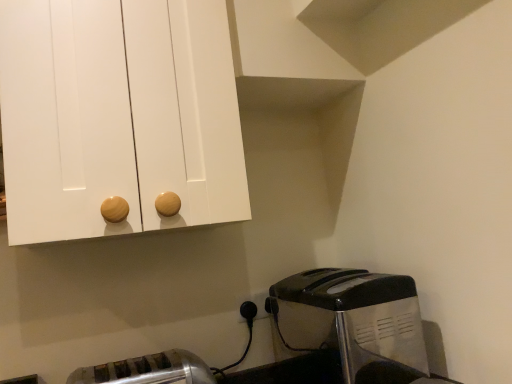
Identify the location of satin silver toaster at lower left, placed as the first toaster when sorted from left to right. (148, 370).

What do you see at coordinates (351, 322) in the screenshot? I see `metallic silver toaster at lower right, the first toaster in the right-to-left sequence` at bounding box center [351, 322].

This screenshot has width=512, height=384. Identify the location of satin silver toaster at lower left, which appears as the 2th toaster when viewed from the right. coord(148,370).

Does point (321, 269) lie behind point (255, 297)?

Yes, it is behind point (255, 297).

From the picture: Is metallic silver toaster at lower right, the first toaster in the right-to-left sequence, looking in the opposite direction of white plastic electric outlet at lower center?

No, metallic silver toaster at lower right, the first toaster in the right-to-left sequence,'s orientation is not away from white plastic electric outlet at lower center.

Can you confirm if metallic silver toaster at lower right, the first toaster in the right-to-left sequence, is positioned to the right of white plastic electric outlet at lower center?

Yes.

Is satin silver toaster at lower left, which appears as the 2th toaster when viewed from the right, surrounded by metallic silver toaster at lower right, the first toaster in the right-to-left sequence?

No, satin silver toaster at lower left, which appears as the 2th toaster when viewed from the right, is not a part of metallic silver toaster at lower right, the first toaster in the right-to-left sequence.

Which point is more distant from viewer, (345, 344) or (188, 359)?

The point (188, 359) is farther from the camera.

How different are the orientations of metallic silver toaster at lower right, the first toaster in the right-to-left sequence, and satin silver toaster at lower left, placed as the first toaster when sorted from left to right, in degrees?

89.8 degrees.

From the image's perspective, which one is positioned lower, metallic silver toaster at lower right, which is the 2th toaster in left-to-right order, or satin silver toaster at lower left, which appears as the 2th toaster when viewed from the right?

satin silver toaster at lower left, which appears as the 2th toaster when viewed from the right, is shown below in the image.

This screenshot has width=512, height=384. Find the location of `electric outlet that is on the right side of satin silver toaster at lower left, which appears as the 2th toaster when viewed from the right`. electric outlet that is on the right side of satin silver toaster at lower left, which appears as the 2th toaster when viewed from the right is located at coordinates point(257,303).

Does point (257, 301) appear closer or farther from the camera than point (195, 360)?

Point (257, 301).

What's the angular difference between white plastic electric outlet at lower center and satin silver toaster at lower left, which appears as the 2th toaster when viewed from the right,'s facing directions?

white plastic electric outlet at lower center and satin silver toaster at lower left, which appears as the 2th toaster when viewed from the right, are facing 1.18 degrees away from each other.

From the image's perspective, which object appears higher, white plastic electric outlet at lower center or satin silver toaster at lower left, placed as the first toaster when sorted from left to right?

white plastic electric outlet at lower center, from the image's perspective.

From a real-world perspective, between satin silver toaster at lower left, placed as the first toaster when sorted from left to right, and metallic silver toaster at lower right, the first toaster in the right-to-left sequence, who is vertically higher?

In real-world perspective, metallic silver toaster at lower right, the first toaster in the right-to-left sequence, is above.

Which point is more distant from viewer, (158, 377) or (411, 316)?

The point (411, 316) is farther.

Can we say satin silver toaster at lower left, which appears as the 2th toaster when viewed from the right, lies outside metallic silver toaster at lower right, which is the 2th toaster in left-to-right order?

Yes, satin silver toaster at lower left, which appears as the 2th toaster when viewed from the right, is not within metallic silver toaster at lower right, which is the 2th toaster in left-to-right order.

Measure the distance between satin silver toaster at lower left, which appears as the 2th toaster when viewed from the right, and white plastic electric outlet at lower center.

satin silver toaster at lower left, which appears as the 2th toaster when viewed from the right, and white plastic electric outlet at lower center are 13.75 inches apart from each other.

Considering the positions of points (149, 378) and (251, 298), is point (149, 378) farther from camera compared to point (251, 298)?

No, (149, 378) is closer to viewer.

From the image's perspective, between satin silver toaster at lower left, placed as the first toaster when sorted from left to right, and white plastic electric outlet at lower center, which one is located above?

white plastic electric outlet at lower center.

How different are the orientations of satin silver toaster at lower left, placed as the first toaster when sorted from left to right, and white plastic electric outlet at lower center in degrees?

The angle between the facing direction of satin silver toaster at lower left, placed as the first toaster when sorted from left to right, and the facing direction of white plastic electric outlet at lower center is 1.18 degrees.

Between white plastic electric outlet at lower center and metallic silver toaster at lower right, the first toaster in the right-to-left sequence, which one has larger width?

Wider between the two is metallic silver toaster at lower right, the first toaster in the right-to-left sequence.

What's the angular difference between white plastic electric outlet at lower center and metallic silver toaster at lower right, the first toaster in the right-to-left sequence,'s facing directions?

The facing directions of white plastic electric outlet at lower center and metallic silver toaster at lower right, the first toaster in the right-to-left sequence, are 91 degrees apart.

Based on the photo, would you say metallic silver toaster at lower right, which is the 2th toaster in left-to-right order, is part of white plastic electric outlet at lower center's contents?

No, metallic silver toaster at lower right, which is the 2th toaster in left-to-right order, is not a part of white plastic electric outlet at lower center.

Considering the positions of objects white plastic electric outlet at lower center and metallic silver toaster at lower right, the first toaster in the right-to-left sequence, in the image provided, who is more to the right, white plastic electric outlet at lower center or metallic silver toaster at lower right, the first toaster in the right-to-left sequence,?

metallic silver toaster at lower right, the first toaster in the right-to-left sequence, is more to the right.

The width and height of the screenshot is (512, 384). Find the location of `the 1st toaster directly beneath the white plastic electric outlet at lower center (from a real-world perspective)`. the 1st toaster directly beneath the white plastic electric outlet at lower center (from a real-world perspective) is located at coordinates (351, 322).

The image size is (512, 384). Identify the location of toaster above the satin silver toaster at lower left, which appears as the 2th toaster when viewed from the right (from the image's perspective). (351, 322).

From the image, which object appears to be nearer to satin silver toaster at lower left, which appears as the 2th toaster when viewed from the right, metallic silver toaster at lower right, which is the 2th toaster in left-to-right order, or white plastic electric outlet at lower center?

white plastic electric outlet at lower center is closer to satin silver toaster at lower left, which appears as the 2th toaster when viewed from the right.

From the picture: Looking at the image, which one is located closer to white plastic electric outlet at lower center, metallic silver toaster at lower right, which is the 2th toaster in left-to-right order, or satin silver toaster at lower left, placed as the first toaster when sorted from left to right?

Among the two, metallic silver toaster at lower right, which is the 2th toaster in left-to-right order, is located nearer to white plastic electric outlet at lower center.

Which object lies nearer to the anchor point satin silver toaster at lower left, which appears as the 2th toaster when viewed from the right, white plastic electric outlet at lower center or metallic silver toaster at lower right, the first toaster in the right-to-left sequence?

The object closer to satin silver toaster at lower left, which appears as the 2th toaster when viewed from the right, is white plastic electric outlet at lower center.

Which object lies nearer to the anchor point metallic silver toaster at lower right, the first toaster in the right-to-left sequence, satin silver toaster at lower left, which appears as the 2th toaster when viewed from the right, or white plastic electric outlet at lower center?

white plastic electric outlet at lower center is positioned closer to the anchor metallic silver toaster at lower right, the first toaster in the right-to-left sequence.

Looking at the image, which one is located closer to white plastic electric outlet at lower center, satin silver toaster at lower left, which appears as the 2th toaster when viewed from the right, or metallic silver toaster at lower right, the first toaster in the right-to-left sequence?

metallic silver toaster at lower right, the first toaster in the right-to-left sequence, is positioned closer to the anchor white plastic electric outlet at lower center.

Based on their spatial positions, is white plastic electric outlet at lower center or satin silver toaster at lower left, placed as the first toaster when sorted from left to right, closer to metallic silver toaster at lower right, the first toaster in the right-to-left sequence?

Based on the image, white plastic electric outlet at lower center appears to be nearer to metallic silver toaster at lower right, the first toaster in the right-to-left sequence.

I want to click on toaster between satin silver toaster at lower left, which appears as the 2th toaster when viewed from the right, and white plastic electric outlet at lower center from front to back, so click(x=351, y=322).